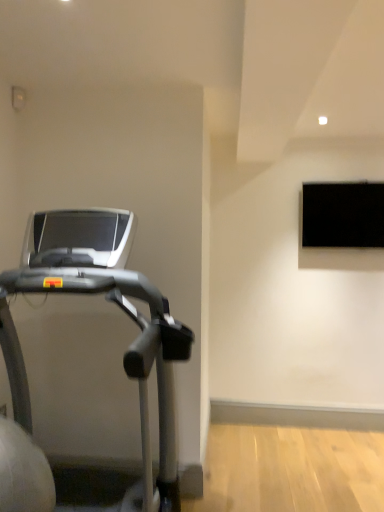
What do you see at coordinates (341, 226) in the screenshot? I see `black matte tv at upper right` at bounding box center [341, 226].

Identify the location of black matte tv at upper right. The image size is (384, 512). (341, 226).

In order to face black matte tv at upper right, should I rotate leftwards or rightwards?

To face it directly, rotate right by 19.849 degrees.

Measure the distance between black matte tv at upper right and camera.

black matte tv at upper right and camera are 3.28 meters apart from each other.

In order to click on silver metallic treadmill at left in this screenshot , I will do `click(118, 306)`.

Describe the element at coordinates (118, 306) in the screenshot. I see `silver metallic treadmill at left` at that location.

Identify the location of black matte tv at upper right. (341, 226).

Considering the positions of objects silver metallic treadmill at left and black matte tv at upper right in the image provided, who is more to the right, silver metallic treadmill at left or black matte tv at upper right?

From the viewer's perspective, black matte tv at upper right appears more on the right side.

Which object is closer to the camera taking this photo, silver metallic treadmill at left or black matte tv at upper right?

silver metallic treadmill at left is more forward.

Is point (132, 495) closer or farther from the camera than point (362, 253)?

Point (132, 495).

From the image's perspective, is silver metallic treadmill at left beneath black matte tv at upper right?

Yes.

From a real-world perspective, who is located higher, silver metallic treadmill at left or black matte tv at upper right?

black matte tv at upper right.

Is silver metallic treadmill at left thinner than black matte tv at upper right?

No, silver metallic treadmill at left is not thinner than black matte tv at upper right.

Considering the sizes of objects silver metallic treadmill at left and black matte tv at upper right in the image provided, who is taller, silver metallic treadmill at left or black matte tv at upper right?

With more height is silver metallic treadmill at left.

Can you confirm if silver metallic treadmill at left is bigger than black matte tv at upper right?

Correct, silver metallic treadmill at left is larger in size than black matte tv at upper right.

Is silver metallic treadmill at left surrounding black matte tv at upper right?

No, black matte tv at upper right is located outside of silver metallic treadmill at left.

Is silver metallic treadmill at left not near black matte tv at upper right?

Yes.

Is silver metallic treadmill at left turned away from black matte tv at upper right?

No, silver metallic treadmill at left's orientation is not away from black matte tv at upper right.

How many degrees apart are the facing directions of silver metallic treadmill at left and black matte tv at upper right?

The angular difference between silver metallic treadmill at left and black matte tv at upper right is 90.9 degrees.

Where is `window above the silver metallic treadmill at left (from a real-world perspective)`? The height and width of the screenshot is (512, 384). window above the silver metallic treadmill at left (from a real-world perspective) is located at coordinates (341, 226).

Considering the positions of objects black matte tv at upper right and silver metallic treadmill at left in the image provided, who is more to the left, black matte tv at upper right or silver metallic treadmill at left?

silver metallic treadmill at left is more to the left.

Is black matte tv at upper right in front of or behind silver metallic treadmill at left in the image?

In the image, black matte tv at upper right appears behind silver metallic treadmill at left.

Which is in front, point (306, 260) or point (128, 251)?

The point (128, 251) is closer.

From the image's perspective, is black matte tv at upper right located above or below silver metallic treadmill at left?

From the image's perspective, black matte tv at upper right appears above silver metallic treadmill at left.

From a real-world perspective, between black matte tv at upper right and silver metallic treadmill at left, who is vertically lower?

In real-world perspective, silver metallic treadmill at left is lower.

Between black matte tv at upper right and silver metallic treadmill at left, which one has smaller width?

black matte tv at upper right is thinner.

Who is taller, black matte tv at upper right or silver metallic treadmill at left?

silver metallic treadmill at left is taller.

Does black matte tv at upper right have a larger size compared to silver metallic treadmill at left?

Incorrect, black matte tv at upper right is not larger than silver metallic treadmill at left.

Is black matte tv at upper right outside of silver metallic treadmill at left?

Yes, black matte tv at upper right is not within silver metallic treadmill at left.

Is black matte tv at upper right far away from silver metallic treadmill at left?

Indeed, black matte tv at upper right is not near silver metallic treadmill at left.

Does black matte tv at upper right turn towards silver metallic treadmill at left?

No, black matte tv at upper right is not turned towards silver metallic treadmill at left.

You are a GUI agent. You are given a task and a screenshot of the screen. Output one action in this format:
    pyautogui.click(x=<x>, y=<y>)
    Task: Click on the window behind the silver metallic treadmill at left
    
    Given the screenshot: What is the action you would take?
    pyautogui.click(x=341, y=226)

This screenshot has width=384, height=512. I want to click on window located above the silver metallic treadmill at left (from a real-world perspective), so click(341, 226).

You are a GUI agent. You are given a task and a screenshot of the screen. Output one action in this format:
    pyautogui.click(x=<x>, y=<y>)
    Task: Click on the treadmill below the black matte tv at upper right (from a real-world perspective)
    The height and width of the screenshot is (512, 384).
    Given the screenshot: What is the action you would take?
    pyautogui.click(x=118, y=306)